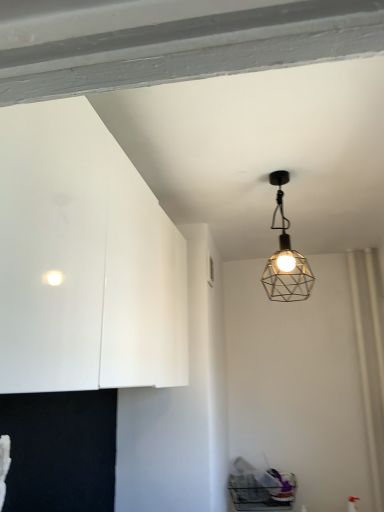
You are a GUI agent. You are given a task and a screenshot of the screen. Output one action in this format:
    pyautogui.click(x=<x>, y=<y>)
    Task: Click on the metallic wireframe lamp at upper center
    The image size is (384, 512).
    Given the screenshot: What is the action you would take?
    pyautogui.click(x=285, y=257)

The height and width of the screenshot is (512, 384). Describe the element at coordinates (285, 257) in the screenshot. I see `metallic wireframe lamp at upper center` at that location.

What do you see at coordinates (84, 260) in the screenshot? The height and width of the screenshot is (512, 384). I see `white glossy cabinet at left` at bounding box center [84, 260].

Locate an element on the screen. The image size is (384, 512). white glossy cabinet at left is located at coordinates (84, 260).

Find the location of a particular element. metallic wireframe lamp at upper center is located at coordinates (285, 257).

Considering the relative positions of metallic wireframe lamp at upper center and white glossy cabinet at left in the image provided, is metallic wireframe lamp at upper center to the left or to the right of white glossy cabinet at left?

In the image, metallic wireframe lamp at upper center appears on the right side of white glossy cabinet at left.

Which is behind, metallic wireframe lamp at upper center or white glossy cabinet at left?

metallic wireframe lamp at upper center is further away from the camera.

Does point (276, 281) come behind point (23, 246)?

That is True.

From the image's perspective, is metallic wireframe lamp at upper center on top of white glossy cabinet at left?

Correct, metallic wireframe lamp at upper center appears higher than white glossy cabinet at left in the image.

From a real-world perspective, is metallic wireframe lamp at upper center located beneath white glossy cabinet at left?

No.

Between metallic wireframe lamp at upper center and white glossy cabinet at left, which one has larger width?

Wider between the two is white glossy cabinet at left.

Considering the relative sizes of metallic wireframe lamp at upper center and white glossy cabinet at left in the image provided, is metallic wireframe lamp at upper center taller than white glossy cabinet at left?

No.

Which of these two, metallic wireframe lamp at upper center or white glossy cabinet at left, is smaller?

Smaller between the two is metallic wireframe lamp at upper center.

Is metallic wireframe lamp at upper center positioned beyond the bounds of white glossy cabinet at left?

That's correct, metallic wireframe lamp at upper center is outside of white glossy cabinet at left.

Is metallic wireframe lamp at upper center touching white glossy cabinet at left?

There is a gap between metallic wireframe lamp at upper center and white glossy cabinet at left.

Is metallic wireframe lamp at upper center oriented away from white glossy cabinet at left?

No, metallic wireframe lamp at upper center is not facing away from white glossy cabinet at left.

How different are the orientations of metallic wireframe lamp at upper center and white glossy cabinet at left in degrees?

They differ by 89 degrees in their facing directions.

The image size is (384, 512). I want to click on lamp above the white glossy cabinet at left (from the image's perspective), so tap(285, 257).

Can you confirm if white glossy cabinet at left is positioned to the left of metallic wireframe lamp at upper center?

Yes, white glossy cabinet at left is to the left of metallic wireframe lamp at upper center.

Considering the relative positions of white glossy cabinet at left and metallic wireframe lamp at upper center in the image provided, is white glossy cabinet at left in front of metallic wireframe lamp at upper center?

Yes, it is in front of metallic wireframe lamp at upper center.

Which is nearer, (95, 268) or (283, 245)?

Point (95, 268) is positioned closer to the camera compared to point (283, 245).

From the image's perspective, who appears lower, white glossy cabinet at left or metallic wireframe lamp at upper center?

white glossy cabinet at left is shown below in the image.

From a real-world perspective, which object stands above the other?

metallic wireframe lamp at upper center, from a real-world perspective.

Which of these two, white glossy cabinet at left or metallic wireframe lamp at upper center, is wider?

white glossy cabinet at left is wider.

Considering the sizes of white glossy cabinet at left and metallic wireframe lamp at upper center in the image, is white glossy cabinet at left taller or shorter than metallic wireframe lamp at upper center?

In the image, white glossy cabinet at left appears to be taller than metallic wireframe lamp at upper center.

Between white glossy cabinet at left and metallic wireframe lamp at upper center, which one has smaller size?

Smaller between the two is metallic wireframe lamp at upper center.

Is white glossy cabinet at left positioned beyond the bounds of metallic wireframe lamp at upper center?

white glossy cabinet at left is positioned outside metallic wireframe lamp at upper center.

Consider the image. Is white glossy cabinet at left far from metallic wireframe lamp at upper center?

No, white glossy cabinet at left is in close proximity to metallic wireframe lamp at upper center.

Consider the image. Is white glossy cabinet at left facing towards metallic wireframe lamp at upper center?

Yes, white glossy cabinet at left is facing metallic wireframe lamp at upper center.

How different are the orientations of white glossy cabinet at left and metallic wireframe lamp at upper center in degrees?

89 degrees separate the facing orientations of white glossy cabinet at left and metallic wireframe lamp at upper center.

At what (x,y) coordinates should I click in order to perform the action: click on lamp above the white glossy cabinet at left (from the image's perspective). Please return your answer as a coordinate pair (x, y). Looking at the image, I should click on (285, 257).

Where is `lamp positioned vertically above the white glossy cabinet at left (from a real-world perspective)`? The width and height of the screenshot is (384, 512). lamp positioned vertically above the white glossy cabinet at left (from a real-world perspective) is located at coordinates pos(285,257).

Where is `lamp behind the white glossy cabinet at left`? This screenshot has width=384, height=512. lamp behind the white glossy cabinet at left is located at coordinates (285, 257).